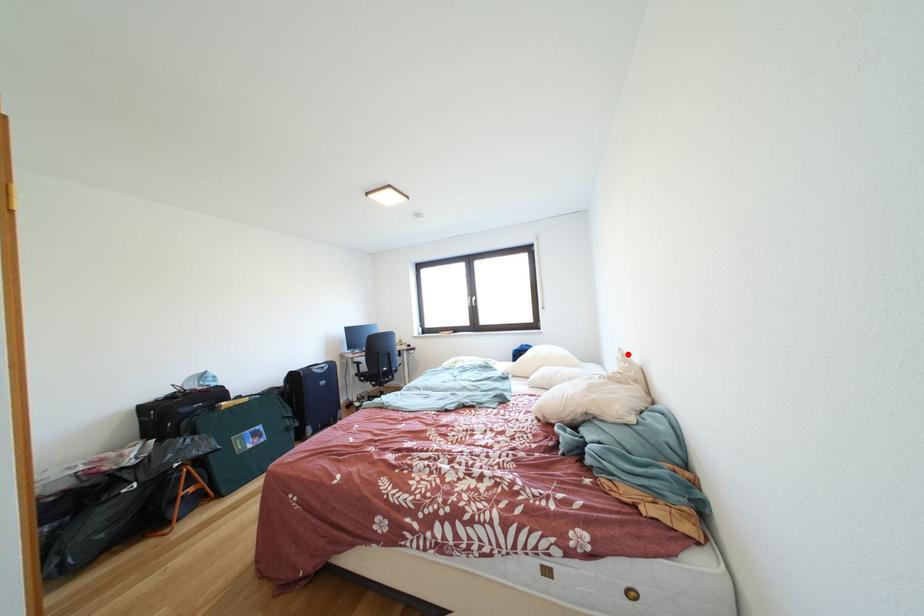
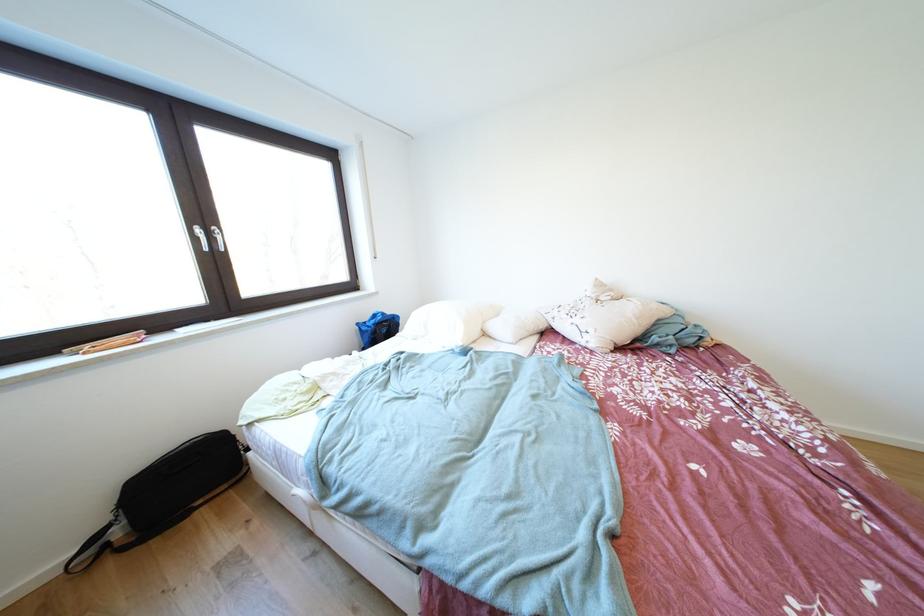
In the second image, find the point that corresponds to the highlighted location in the first image.

(604, 284)